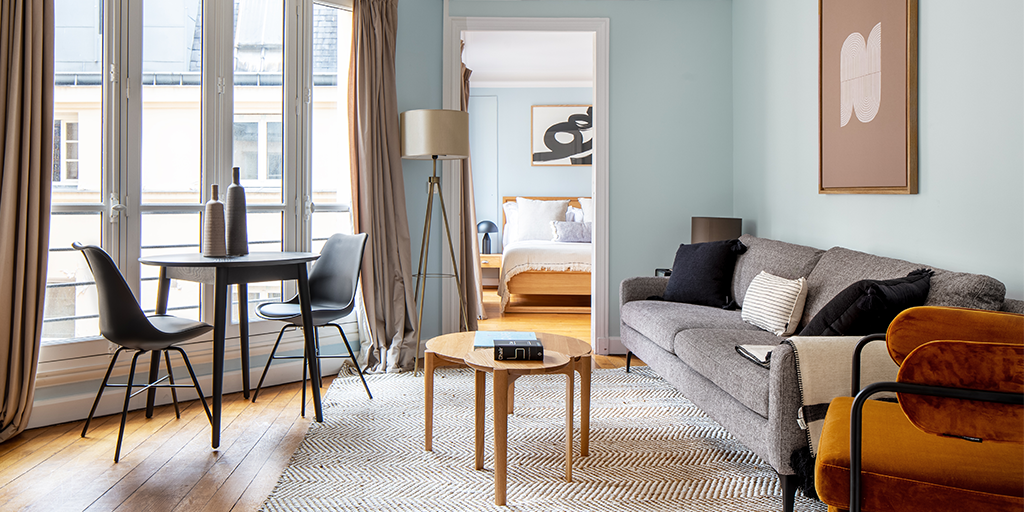
Locate an element on the screen. The width and height of the screenshot is (1024, 512). blanket is located at coordinates (823, 353).